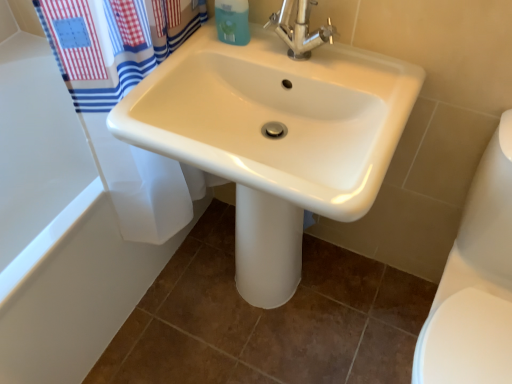
Find the location of a particular element. This screenshot has width=512, height=384. vacant space situated on the left part of chrome metallic faucet at upper center is located at coordinates (228, 60).